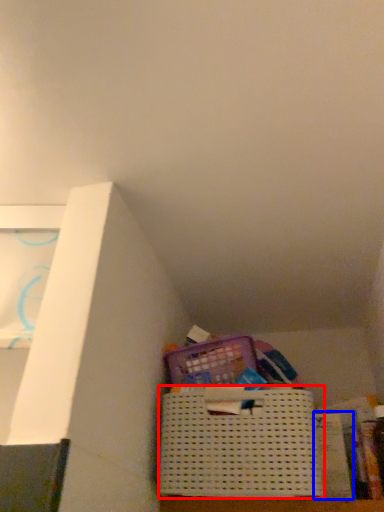
Question: Which object appears farthest to the camera in this image, basket (highlighted by a red box) or paperback book (highlighted by a blue box)?

Choices:
 (A) basket
 (B) paperback book

Answer: (B)